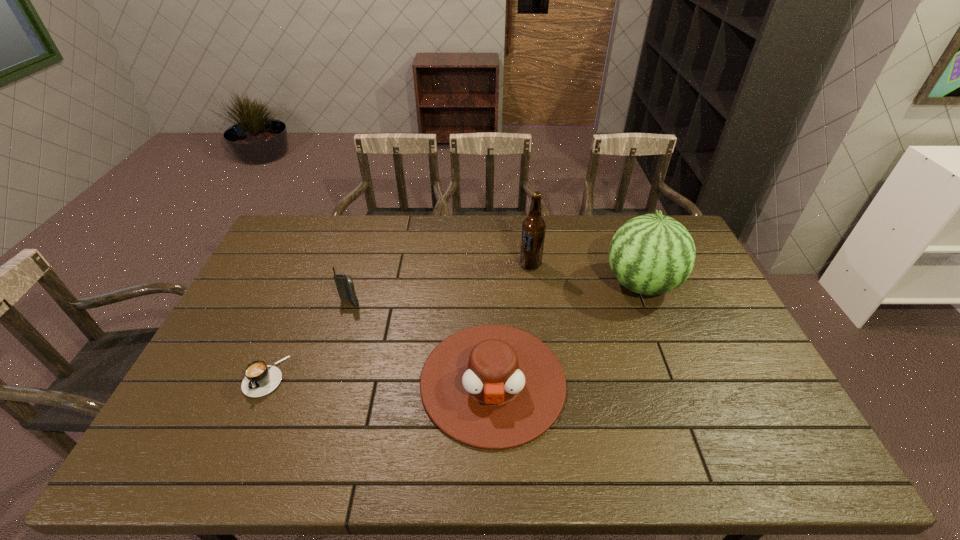
Identify the location of free point between the cellular telephone and the cowboy hat. This screenshot has height=540, width=960. (421, 342).

Locate an element on the screen. free space between the third shortest object and the rightmost object is located at coordinates (495, 294).

Identify the location of free spot between the cellular telephone and the cowboy hat. This screenshot has height=540, width=960. (421, 342).

Find the location of a particular element. The image size is (960, 540). free area in between the cellular telephone and the leftmost object is located at coordinates (307, 340).

This screenshot has height=540, width=960. I want to click on free point between the watermelon and the cowboy hat, so click(567, 333).

At what (x,y) coordinates should I click in order to perform the action: click on vacant area that lies between the cappuccino and the beer bottle. Please return your answer as a coordinate pair (x, y). The height and width of the screenshot is (540, 960). Looking at the image, I should click on (397, 320).

You are a GUI agent. You are given a task and a screenshot of the screen. Output one action in this format:
    pyautogui.click(x=<x>, y=<y>)
    Task: Click on the blank region between the third tallest object and the second shortest object
    This screenshot has height=540, width=960.
    Given the screenshot: What is the action you would take?
    [421, 342]

Find the location of `empty space between the beer bottle and the rightmost object`. empty space between the beer bottle and the rightmost object is located at coordinates (586, 275).

Locate an element on the screen. The height and width of the screenshot is (540, 960). vacant point located between the cowboy hat and the rightmost object is located at coordinates (567, 333).

The height and width of the screenshot is (540, 960). I want to click on vacant point located between the fourth tallest object and the beer bottle, so click(x=512, y=323).